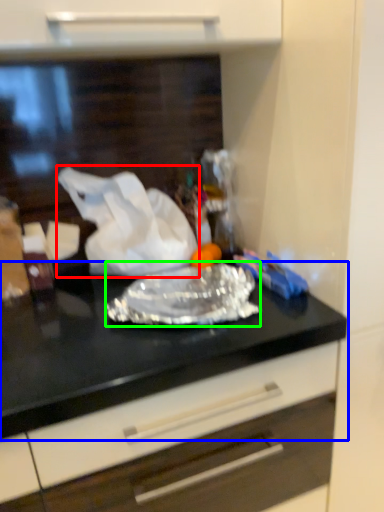
Question: Which object is positioned farthest from wrapping paper (highlighted by a red box)? Select from countertop (highlighted by a blue box) and wrap (highlighted by a green box).

Choices:
 (A) countertop
 (B) wrap

Answer: (A)